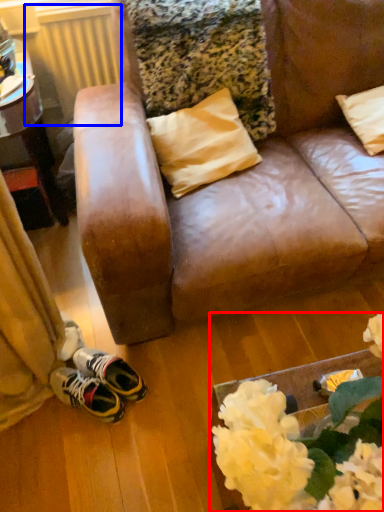
Question: Which object appears farthest to the camera in this image, floral arrangement (highlighted by a red box) or radiator (highlighted by a blue box)?

Choices:
 (A) floral arrangement
 (B) radiator

Answer: (B)